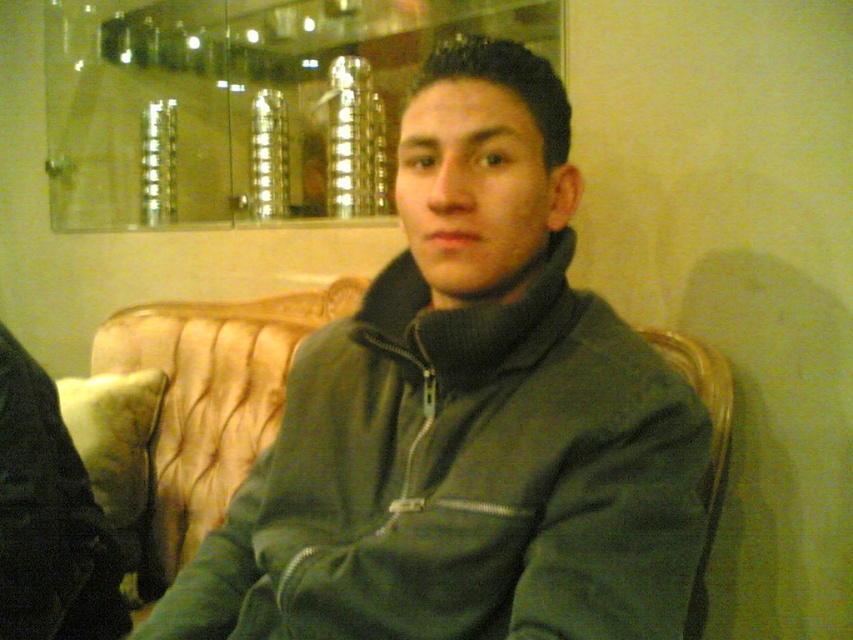
From the picture: Who is positioned more to the right, green matte jacket at center or black fabric at left?

green matte jacket at center is more to the right.

Is green matte jacket at center above black fabric at left?

Indeed, green matte jacket at center is positioned over black fabric at left.

Does point (537, 326) come farther from viewer compared to point (73, 627)?

No, it is in front of (73, 627).

Locate an element on the screen. green matte jacket at center is located at coordinates (466, 417).

Does green matte jacket at center have a greater height compared to green fabric chair at right?

Indeed, green matte jacket at center has a greater height compared to green fabric chair at right.

Is green matte jacket at center positioned before green fabric chair at right?

Yes.

Which is behind, point (270, 544) or point (647, 340)?

Point (647, 340)

The height and width of the screenshot is (640, 853). What are the coordinates of `green matte jacket at center` in the screenshot? It's located at (466, 417).

What do you see at coordinates (49, 518) in the screenshot? I see `black fabric at left` at bounding box center [49, 518].

At what (x,y) coordinates should I click in order to perform the action: click on black fabric at left. Please return your answer as a coordinate pair (x, y). Looking at the image, I should click on (49, 518).